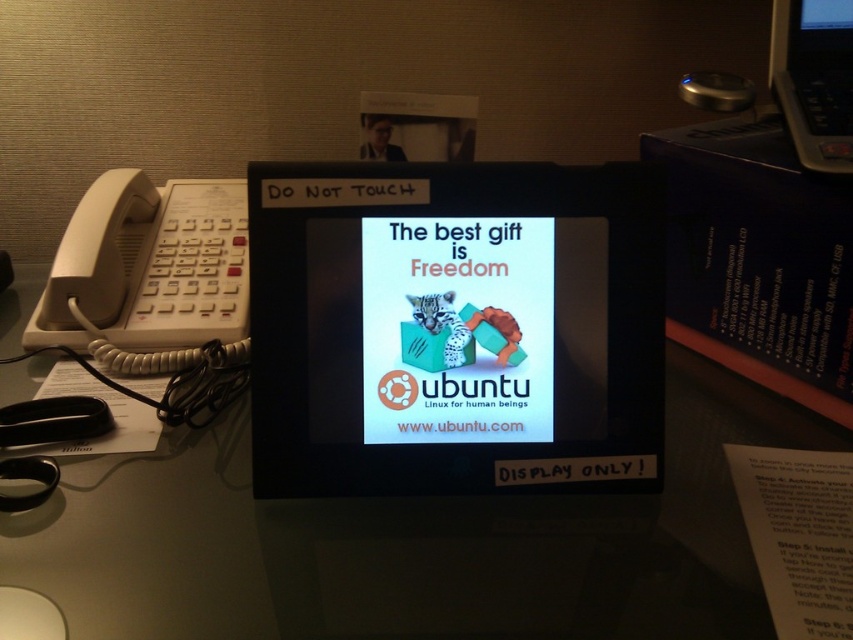
You are an office worker who needs to make an urgent call. There are two phones available in the scene. Can you use both the white plastic phone at left and the black plastic phone at upper right to make a call?

The white plastic phone at left is a standard landline telephone with a coiled cord, so it can be used to make calls. However, the black plastic phone at upper right is part of the display screen labeled as DISPLAY ONLY!, meaning it is likely nonfunctional. Therefore, only the white plastic phone at left can be used to make a call.

You need to place a new object between the matte black monitor at center and the black plastic phone at upper right. Which side should you place it to ensure it fits without overlapping either?

The matte black monitor at center is wider than the black plastic phone at upper right, so placing the new object between them should be closer to the narrower black plastic phone at upper right to avoid overlapping both.

You are an office worker who needs to make a call but cannot touch any items except the ones you can reach. You see a white plastic phone at left and a black plastic phone at upper right. Which phone is taller?

The white plastic phone at left is much taller than the black plastic phone at upper right.